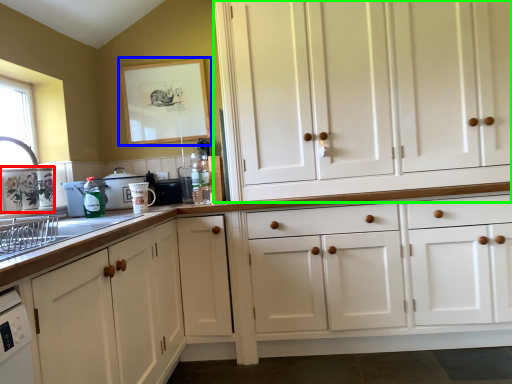
Question: Which object is positioned closest to appliance (highlighted by a red box)? Select from picture frame (highlighted by a blue box) and cabinetry (highlighted by a green box).

Choices:
 (A) picture frame
 (B) cabinetry

Answer: (A)